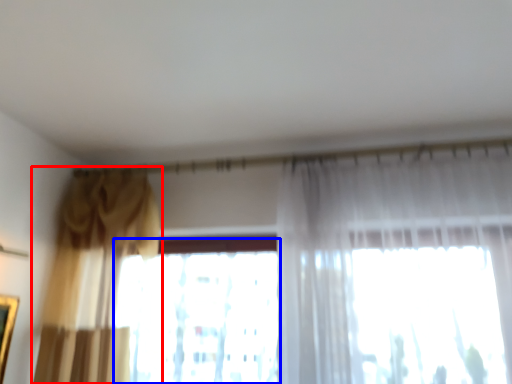
Question: Which of the following is the closest to the observer, curtain (highlighted by a red box) or window (highlighted by a blue box)?

Choices:
 (A) curtain
 (B) window

Answer: (A)